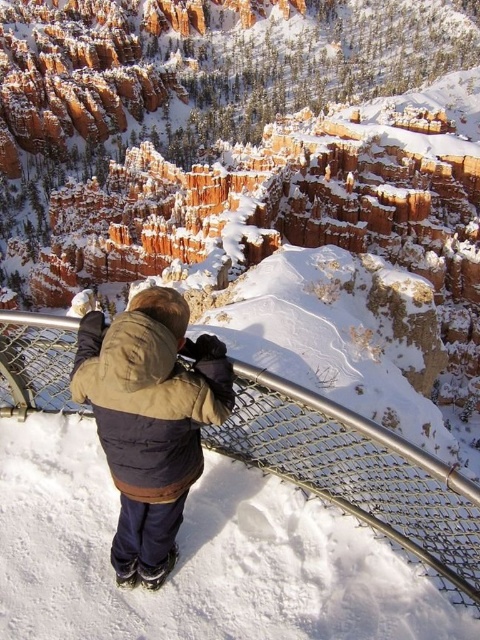
Question: Which point is farther to the camera?

Choices:
 (A) metal mesh railing at center
 (B) brown fuzzy jacket at center

Answer: (A)

Question: Can you confirm if metal mesh railing at center is smaller than brown fuzzy jacket at center?

Choices:
 (A) yes
 (B) no

Answer: (B)

Question: Observing the image, what is the correct spatial positioning of metal mesh railing at center in reference to brown fuzzy jacket at center?

Choices:
 (A) above
 (B) below

Answer: (B)

Question: Which object appears farthest from the camera in this image?

Choices:
 (A) brown fuzzy jacket at center
 (B) metal mesh railing at center

Answer: (B)

Question: From the image, what is the correct spatial relationship of metal mesh railing at center in relation to brown fuzzy jacket at center?

Choices:
 (A) left
 (B) right

Answer: (B)